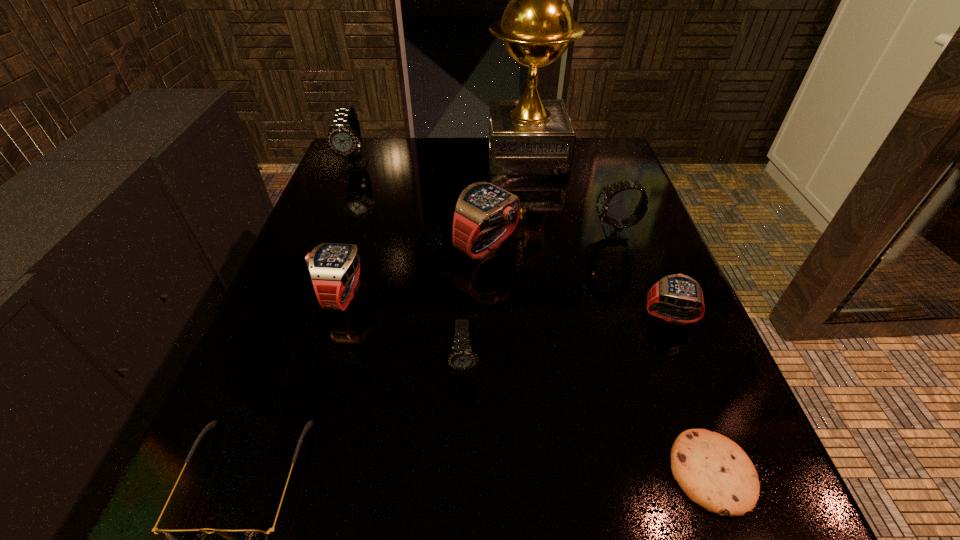
Identify the location of the seventh farthest object. (461, 358).

I want to click on the shortest watch, so click(677, 290).

You are a GUI agent. You are given a task and a screenshot of the screen. Output one action in this format:
    pyautogui.click(x=<x>, y=<y>)
    Task: Click on the third shortest object
    Image resolution: width=960 pixels, height=540 pixels.
    Given the screenshot: What is the action you would take?
    pyautogui.click(x=677, y=290)

Where is `cookie`? The image size is (960, 540). cookie is located at coordinates (714, 472).

The image size is (960, 540). In order to click on blank area located on the front-facing side of the award in this screenshot , I will do `click(438, 155)`.

Image resolution: width=960 pixels, height=540 pixels. I want to click on vacant space located on the front-facing side of the award, so click(x=345, y=155).

Identify the location of vacant region located on the front-facing side of the award. (351, 155).

The image size is (960, 540). What are the coordinates of `vacant space located on the face of the farthest gray watch` in the screenshot? It's located at (307, 287).

Identify the location of free spot located 0.070m on the front of the biggest red watch. (488, 295).

Locate an element on the screen. The width and height of the screenshot is (960, 540). free space located 0.060m on the face of the rightmost gray watch is located at coordinates (564, 233).